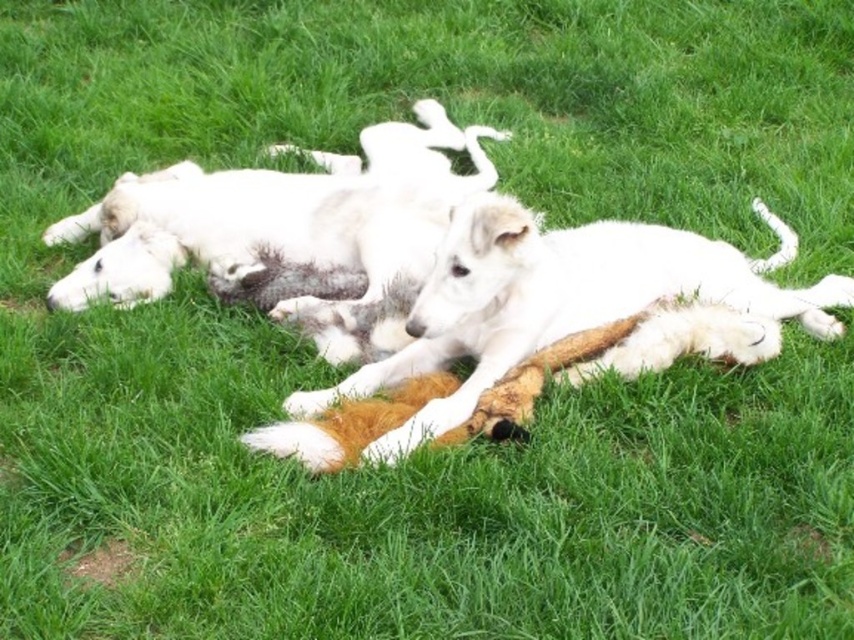
Question: Is white fur dog at center above white fluffy dog at center?

Choices:
 (A) no
 (B) yes

Answer: (A)

Question: Among these points, which one is nearest to the camera?

Choices:
 (A) (366, 196)
 (B) (553, 316)

Answer: (B)

Question: Can you confirm if white fur dog at center is positioned above white fluffy dog at center?

Choices:
 (A) yes
 (B) no

Answer: (B)

Question: Which point is farther to the camera?

Choices:
 (A) (161, 248)
 (B) (822, 278)

Answer: (B)

Question: Is white fur dog at center closer to the viewer compared to white fluffy dog at center?

Choices:
 (A) no
 (B) yes

Answer: (B)

Question: Which point is closer to the camera?

Choices:
 (A) (320, 259)
 (B) (311, 435)

Answer: (B)